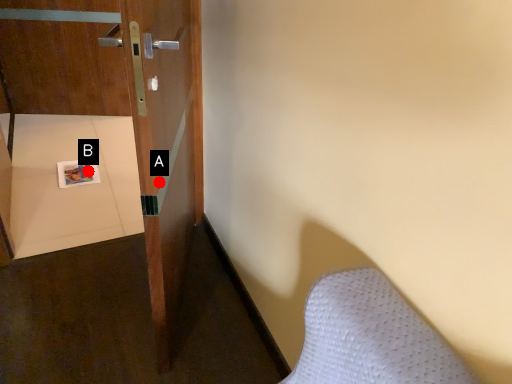
Question: Two points are circled on the image, labeled by A and B beside each circle. Which point is farther to the camera?

Choices:
 (A) A is further
 (B) B is further

Answer: (B)